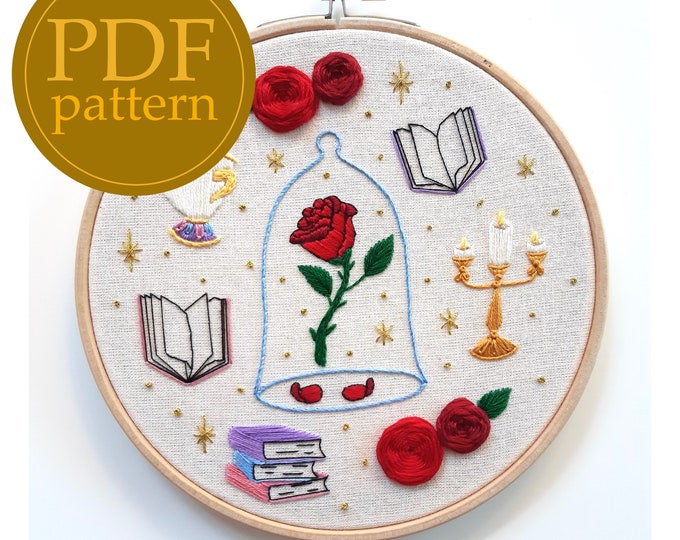
Find the location of a particular element. pink book is located at coordinates (250, 486).